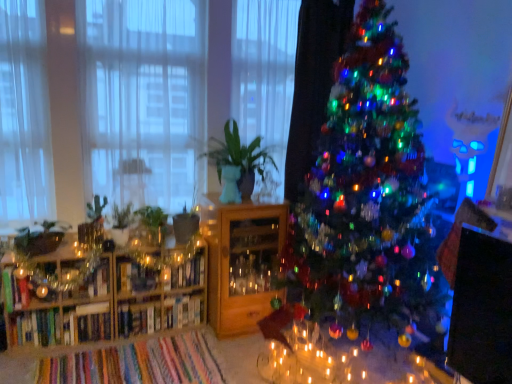
The image size is (512, 384). Find the location of `empty space that is ontop of hardcover book at center, which is the 2th book from right to left (from a real-world perspective)`. empty space that is ontop of hardcover book at center, which is the 2th book from right to left (from a real-world perspective) is located at coordinates (135, 299).